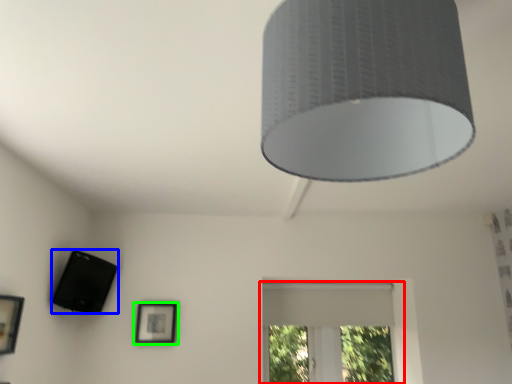
Question: Considering the real-world distances, which object is closest to window (highlighted by a red box)? speaker (highlighted by a blue box) or picture frame (highlighted by a green box).

Choices:
 (A) speaker
 (B) picture frame

Answer: (B)